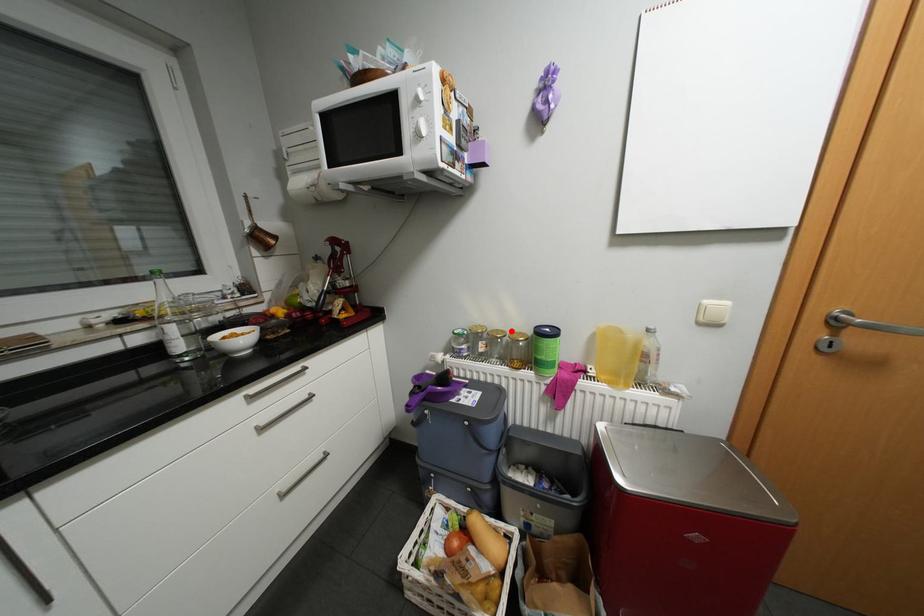
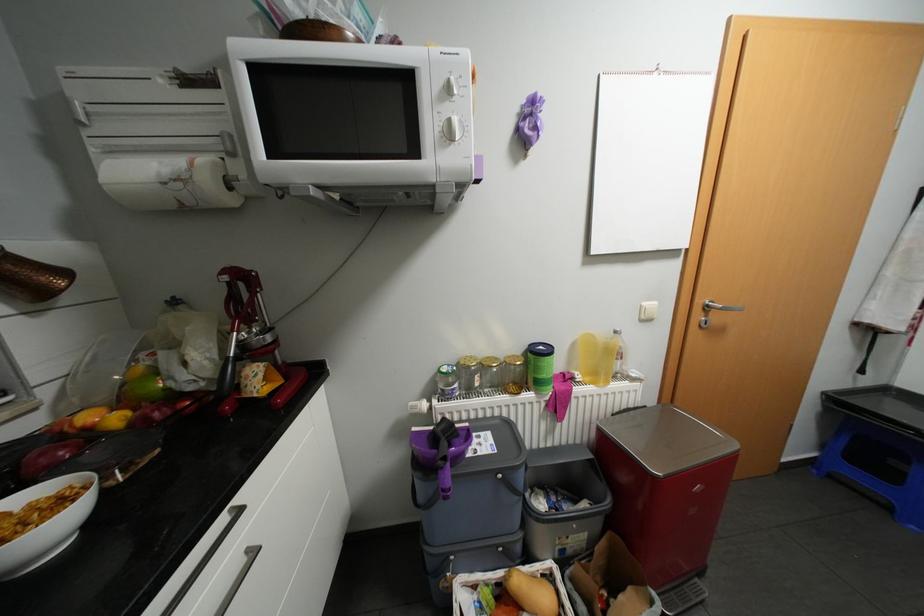
Find the pixel in the second image that matches the highlighted location in the first image.

(504, 358)